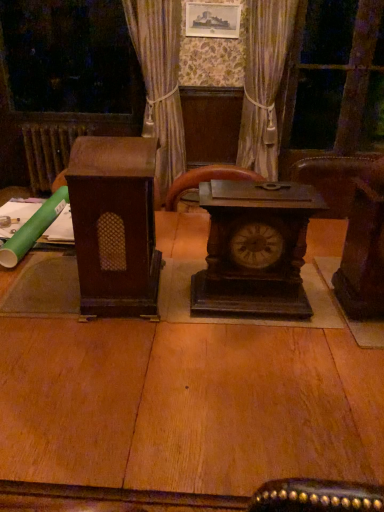
You are a GUI agent. You are given a task and a screenshot of the screen. Output one action in this format:
    pyautogui.click(x=<x>, y=<y>)
    Task: Click on the vacant space to the right of brown wood speaker at left, which appears as the second furniture when viewed from the right
    The image size is (384, 512).
    Given the screenshot: What is the action you would take?
    pyautogui.click(x=188, y=302)